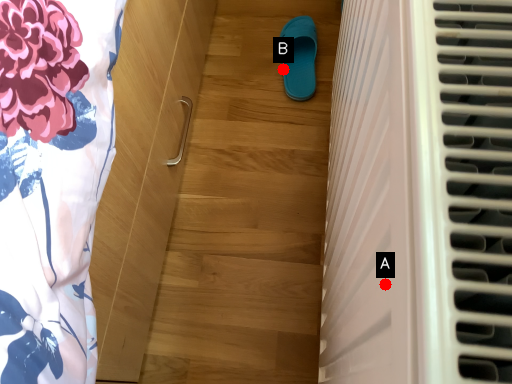
Question: Two points are circled on the image, labeled by A and B beside each circle. Which point is closer to the camera taking this photo?

Choices:
 (A) A is closer
 (B) B is closer

Answer: (A)